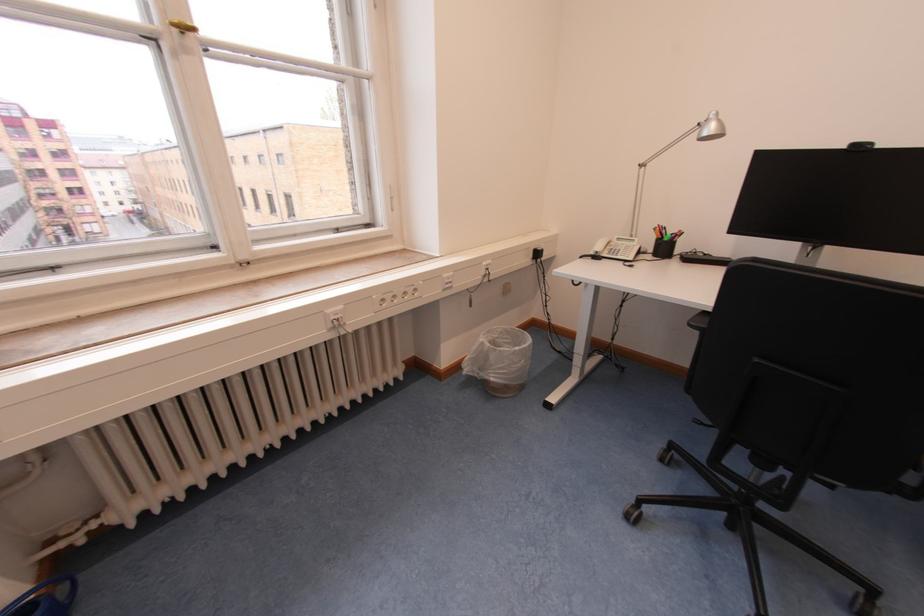
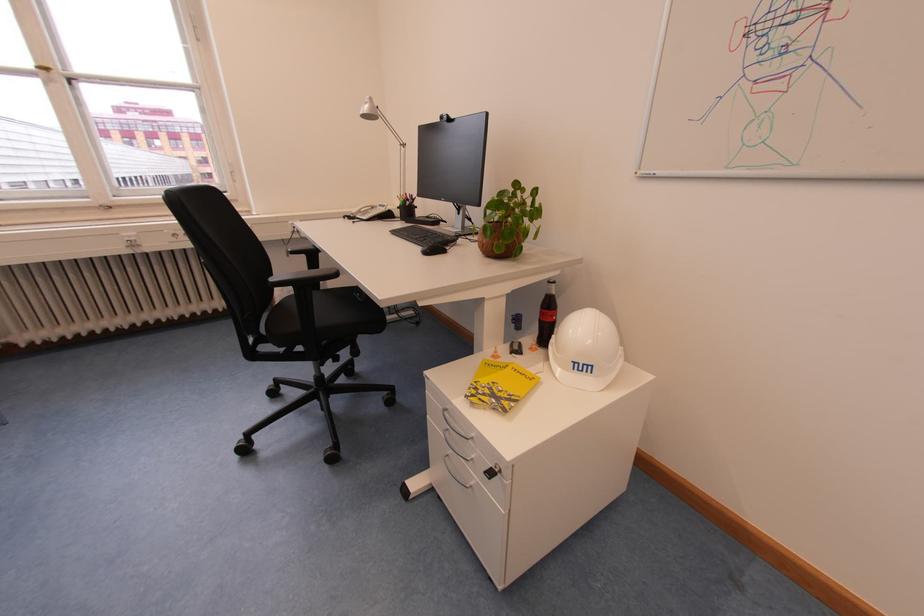
In the second image, find the point that corresponds to the point at 719,130 in the first image.

(372, 111)